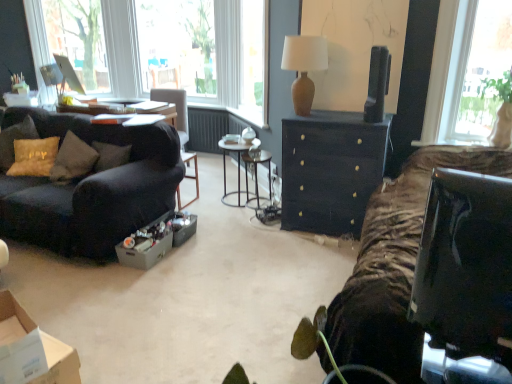
The width and height of the screenshot is (512, 384). Find the location of `vacant area on top of matte black dresser at center (from a real-world perspective)`. vacant area on top of matte black dresser at center (from a real-world perspective) is located at coordinates (336, 114).